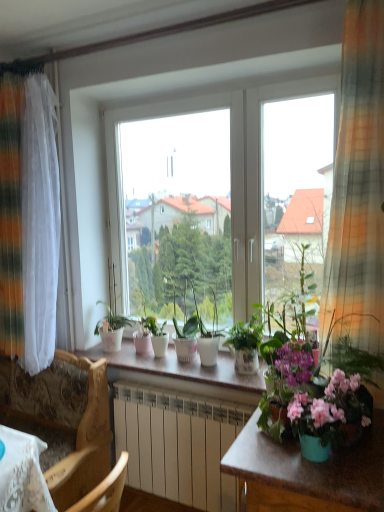
Question: Is the position of white glossy counter top at center more distant than that of white glossy pot at center, acting as the sixth houseplant starting from the right?

Choices:
 (A) yes
 (B) no

Answer: (B)

Question: Can you confirm if white glossy counter top at center is shorter than white glossy pot at center, the first houseplant when ordered from left to right?

Choices:
 (A) yes
 (B) no

Answer: (A)

Question: Is white glossy counter top at center thinner than white glossy pot at center, acting as the sixth houseplant starting from the right?

Choices:
 (A) no
 (B) yes

Answer: (A)

Question: From the image's perspective, is white glossy counter top at center above white glossy pot at center, the first houseplant when ordered from left to right?

Choices:
 (A) no
 (B) yes

Answer: (A)

Question: Can you confirm if white glossy counter top at center is positioned to the left of white glossy pot at center, the first houseplant when ordered from left to right?

Choices:
 (A) yes
 (B) no

Answer: (B)

Question: Is white glossy counter top at center taller or shorter than white glossy pot at center, the 4th houseplant when ordered from left to right?

Choices:
 (A) short
 (B) tall

Answer: (A)

Question: From the image's perspective, is white glossy counter top at center located above or below white glossy pot at center, arranged as the third houseplant when viewed from the right?

Choices:
 (A) above
 (B) below

Answer: (B)

Question: Is white glossy counter top at center inside the boundaries of white glossy pot at center, the 4th houseplant when ordered from left to right, or outside?

Choices:
 (A) outside
 (B) inside

Answer: (A)

Question: Considering the positions of white glossy counter top at center and white glossy pot at center, arranged as the third houseplant when viewed from the right, in the image, is white glossy counter top at center wider or thinner than white glossy pot at center, arranged as the third houseplant when viewed from the right,?

Choices:
 (A) thin
 (B) wide

Answer: (B)

Question: Considering the positions of point (215, 309) and point (119, 316), is point (215, 309) closer or farther from the camera than point (119, 316)?

Choices:
 (A) closer
 (B) farther

Answer: (A)

Question: Is white glossy pot at center, the 4th houseplant when ordered from left to right, inside or outside of white glossy pot at center, acting as the sixth houseplant starting from the right?

Choices:
 (A) inside
 (B) outside

Answer: (B)

Question: In terms of height, does white glossy pot at center, the 4th houseplant when ordered from left to right, look taller or shorter compared to white glossy pot at center, acting as the sixth houseplant starting from the right?

Choices:
 (A) short
 (B) tall

Answer: (A)

Question: Considering the relative positions of white glossy pot at center, arranged as the third houseplant when viewed from the right, and white glossy pot at center, the first houseplant when ordered from left to right, in the image provided, is white glossy pot at center, arranged as the third houseplant when viewed from the right, to the left or to the right of white glossy pot at center, the first houseplant when ordered from left to right,?

Choices:
 (A) right
 (B) left

Answer: (A)

Question: Would you say white glossy pot at center, the 4th houseplant when ordered from left to right, is inside or outside matte white pot at center, positioned as the 4th houseplant in right-to-left order?

Choices:
 (A) inside
 (B) outside

Answer: (B)

Question: Looking at their shapes, would you say white glossy pot at center, arranged as the third houseplant when viewed from the right, is wider or thinner than matte white pot at center, which appears as the 3th houseplant when viewed from the left?

Choices:
 (A) thin
 (B) wide

Answer: (A)